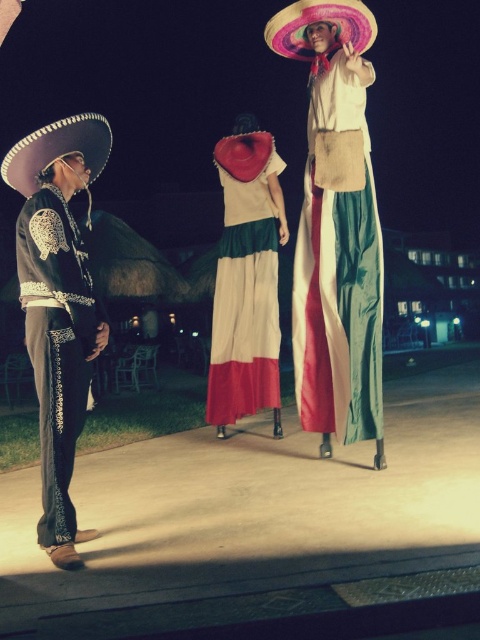
Question: Considering the relative positions of matte fabric dress at center and black satin mariachi outfit at left in the image provided, where is matte fabric dress at center located with respect to black satin mariachi outfit at left?

Choices:
 (A) below
 (B) above

Answer: (B)

Question: In this image, where is matte fabric dress at center located relative to white cotton dress at center?

Choices:
 (A) above
 (B) below

Answer: (A)

Question: Which is farther from the matte fabric dress at center?

Choices:
 (A) white cotton dress at center
 (B) multicolored felt sombrero at upper center
 (C) black satin mariachi outfit at left

Answer: (C)

Question: Which point is closer to the camera?

Choices:
 (A) (359, 52)
 (B) (25, 269)

Answer: (B)

Question: Among these points, which one is farthest from the camera?

Choices:
 (A) (336, 371)
 (B) (330, 4)
 (C) (40, 467)
 (D) (243, 278)

Answer: (D)

Question: Observing the image, what is the correct spatial positioning of black satin mariachi outfit at left in reference to multicolored felt sombrero at upper center?

Choices:
 (A) below
 (B) above

Answer: (A)